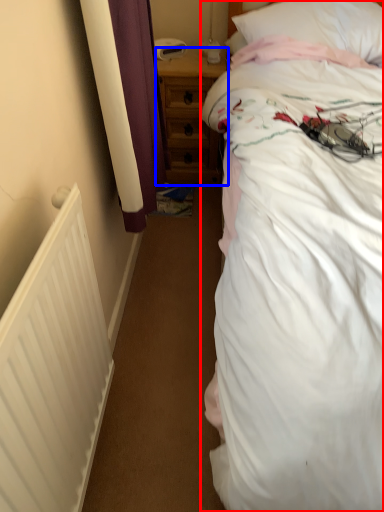
Question: Among these objects, which one is farthest to the camera, bed (highlighted by a red box) or nightstand (highlighted by a blue box)?

Choices:
 (A) bed
 (B) nightstand

Answer: (B)